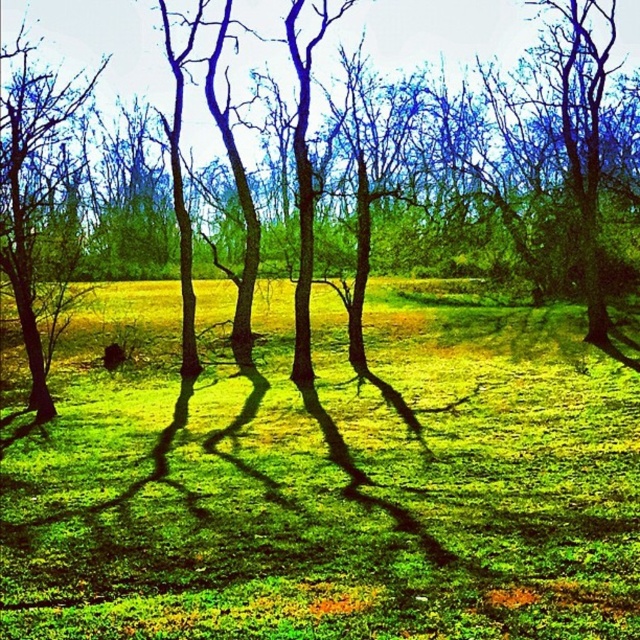
Question: Is green grass at center bigger than smooth bark tree at left?

Choices:
 (A) yes
 (B) no

Answer: (A)

Question: Is green grass at center to the left of smooth bark tree at left from the viewer's perspective?

Choices:
 (A) yes
 (B) no

Answer: (B)

Question: Is green matte tree at center below smooth bark tree at left?

Choices:
 (A) yes
 (B) no

Answer: (B)

Question: Which object is the farthest from the green matte tree at center?

Choices:
 (A) green grass at center
 (B) smooth bark tree at left

Answer: (A)

Question: Estimate the real-world distances between objects in this image. Which object is closer to the smooth bark tree at left?

Choices:
 (A) green grass at center
 (B) green matte tree at center

Answer: (A)

Question: Which point is closer to the camera taking this photo?

Choices:
 (A) (339, 378)
 (B) (420, 52)
 (C) (1, 227)

Answer: (C)